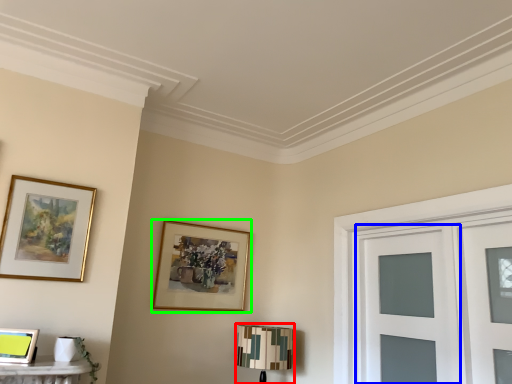
Question: Which is farther away from table lamp (highlighted by a red box)? glass door (highlighted by a blue box) or picture frame (highlighted by a green box)?

Choices:
 (A) glass door
 (B) picture frame

Answer: (A)